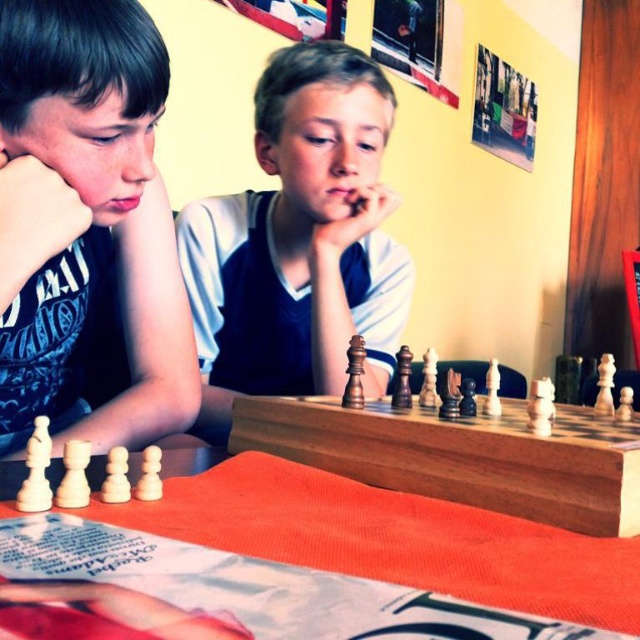
Question: Estimate the real-world distances between objects in this image. Which object is closer to the wooden chessboard at center?

Choices:
 (A) matte black shirt at left
 (B) matte wooden chess piece at center

Answer: (A)

Question: Can you confirm if matte black shirt at left is bigger than matte wooden chess piece at center?

Choices:
 (A) yes
 (B) no

Answer: (B)

Question: Which object is farther from the camera taking this photo?

Choices:
 (A) matte wooden chess piece at center
 (B) matte black shirt at left
 (C) wooden chessboard at center

Answer: (A)

Question: Can you confirm if matte black shirt at left is positioned to the left of matte wooden chess piece at center?

Choices:
 (A) yes
 (B) no

Answer: (A)

Question: Which point is farther to the camera?

Choices:
 (A) matte wooden chess piece at center
 (B) wooden chessboard at center

Answer: (A)

Question: Does matte black shirt at left have a lesser width compared to wooden chessboard at center?

Choices:
 (A) no
 (B) yes

Answer: (B)